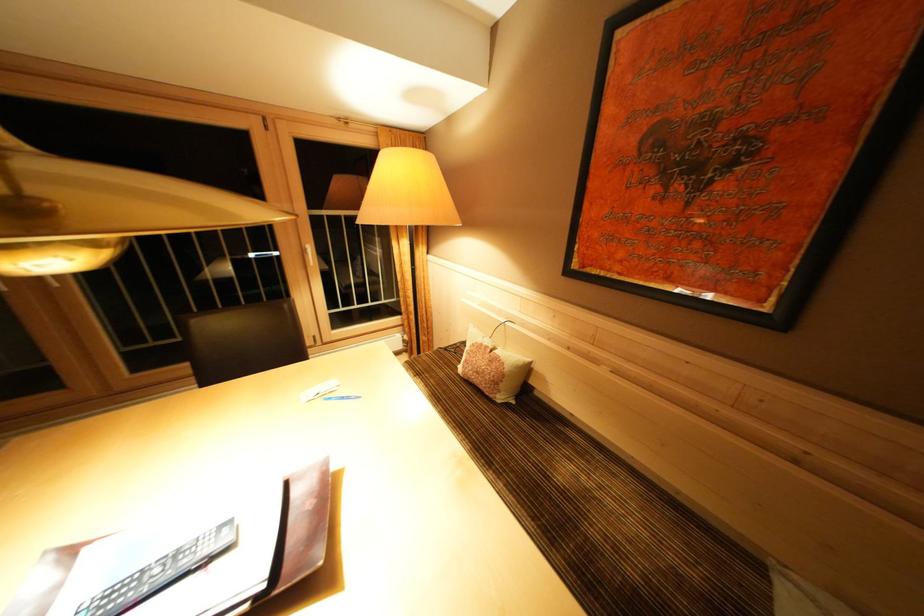
Which object does [161,572] point to?

It corresponds to the black remote control in the image.